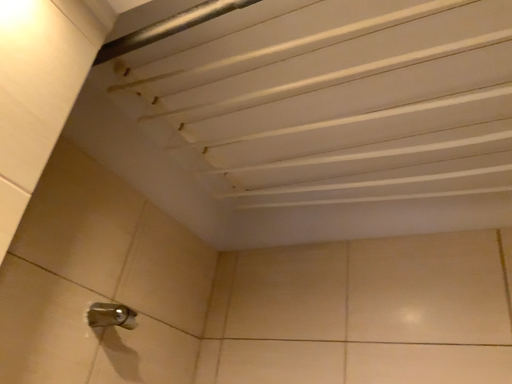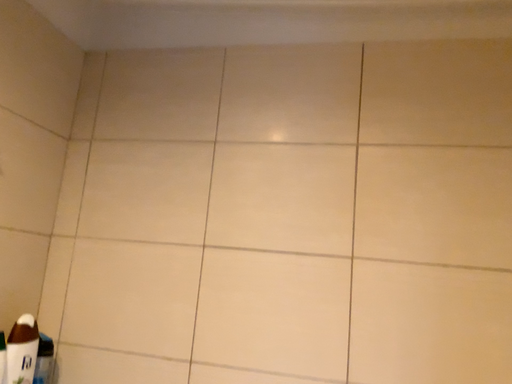
Question: How did the camera likely rotate when shooting the video?

Choices:
 (A) rotated upward
 (B) rotated downward

Answer: (B)